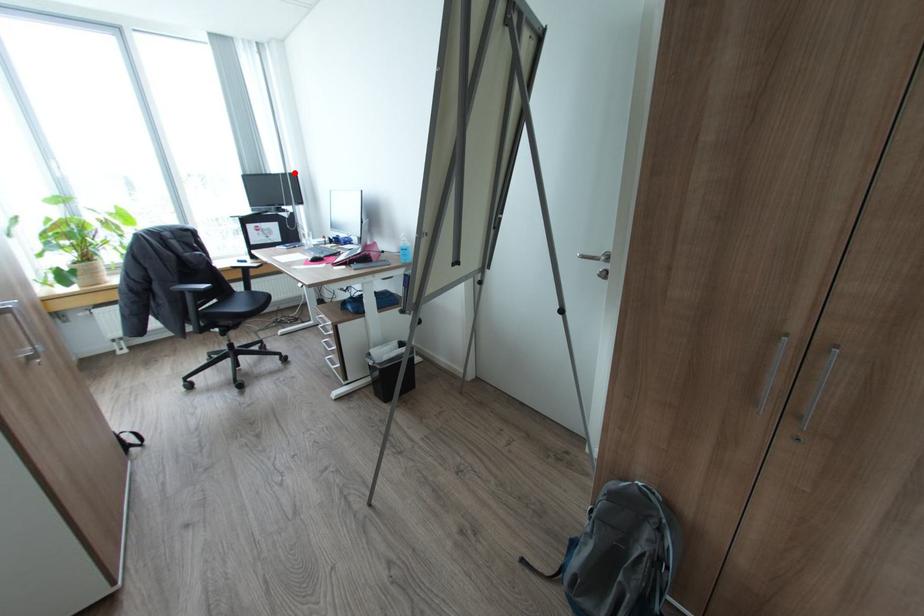
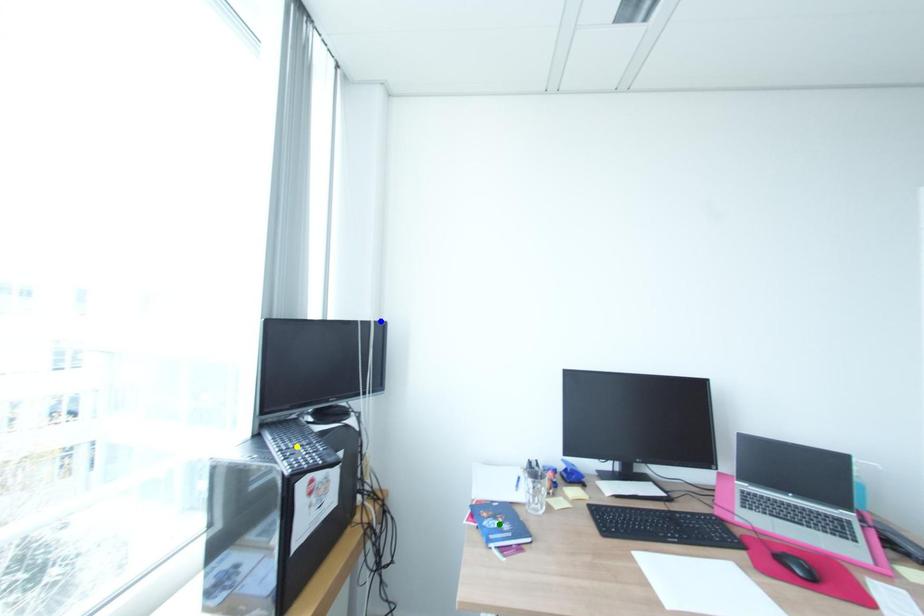
Question: I am providing you with two images of the same scene from different viewpoints. A red point is marked on the first image. You are given multiple points on the second image. Which spot in image 2 lines up with the point in image 1?

Choices:
 (A) blue point
 (B) yellow point
 (C) green point

Answer: (A)